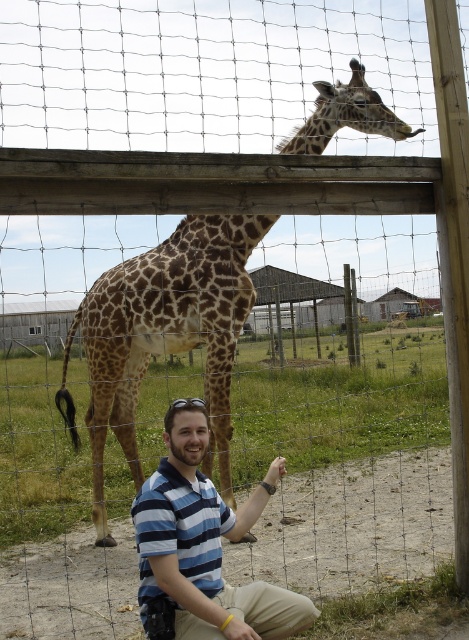
You are a zookeeper who needs to locate the spotted brown giraffe at upper center in the enclosure. According to the coordinates provided, where exactly is the giraffe positioned in the image?

The spotted brown giraffe at upper center is located at the 2D coordinates point (x=165, y=336) in the image.

You are a zoo visitor trying to take a photo of the spotted brown giraffe at upper center without including the blue striped shirt at lower center in the frame. Based on their positions, is this possible?

The spotted brown giraffe at upper center is to the left of the blue striped shirt at lower center, so you can adjust your camera angle to focus on the left side of the giraffe while avoiding the blue striped shirt at lower center on the right.

You are standing at point (x=160, y=518) and want to move to point (x=206, y=269). Is the path between these two points clear of any obstacles?

Point (x=206, y=269) is behind point (x=160, y=518), so the path between them is blocked by the man and the giraffe.